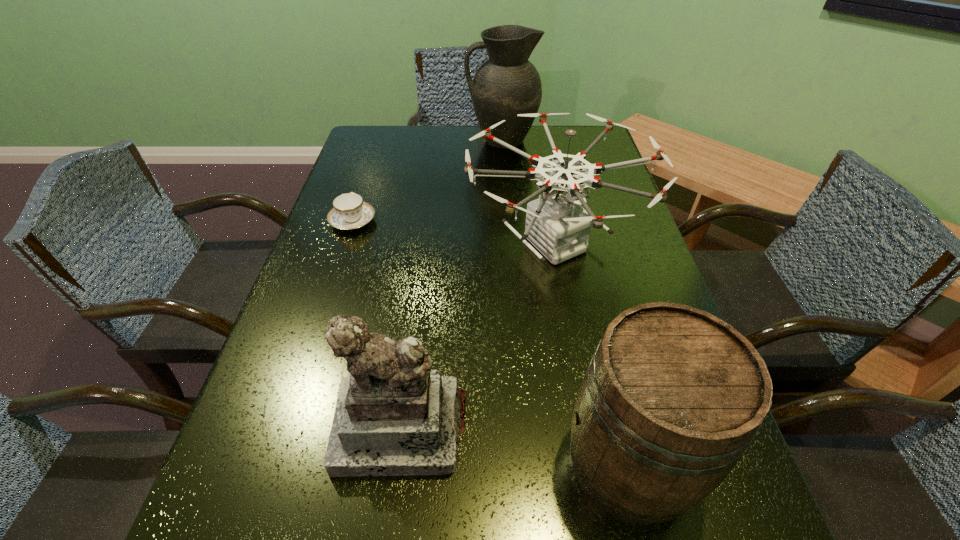
At what (x,y) coordinates should I click in order to perform the action: click on drone that is at the right edge. Please return your answer as a coordinate pair (x, y). Looking at the image, I should click on (557, 225).

The width and height of the screenshot is (960, 540). What are the coordinates of `cider located in the right edge section of the desktop` in the screenshot? It's located at (672, 397).

Identify the location of vacant space at the far edge. This screenshot has width=960, height=540. (414, 126).

Locate an element on the screen. The image size is (960, 540). free space at the left edge is located at coordinates (386, 210).

What are the coordinates of `vacant space at the right edge of the desktop` in the screenshot? It's located at (622, 204).

In the image, there is a desktop. Where is `vacant space at the far left corner`? vacant space at the far left corner is located at coordinates (357, 147).

Where is `vacant point at the far right corner`? The image size is (960, 540). vacant point at the far right corner is located at coordinates (600, 150).

This screenshot has height=540, width=960. Find the location of `free spot between the drone and the cider`. free spot between the drone and the cider is located at coordinates (590, 354).

Find the location of `free point between the leftmost object and the figurine`. free point between the leftmost object and the figurine is located at coordinates pyautogui.click(x=377, y=325).

In order to click on free space between the shortest object and the drone in this screenshot , I will do `click(453, 232)`.